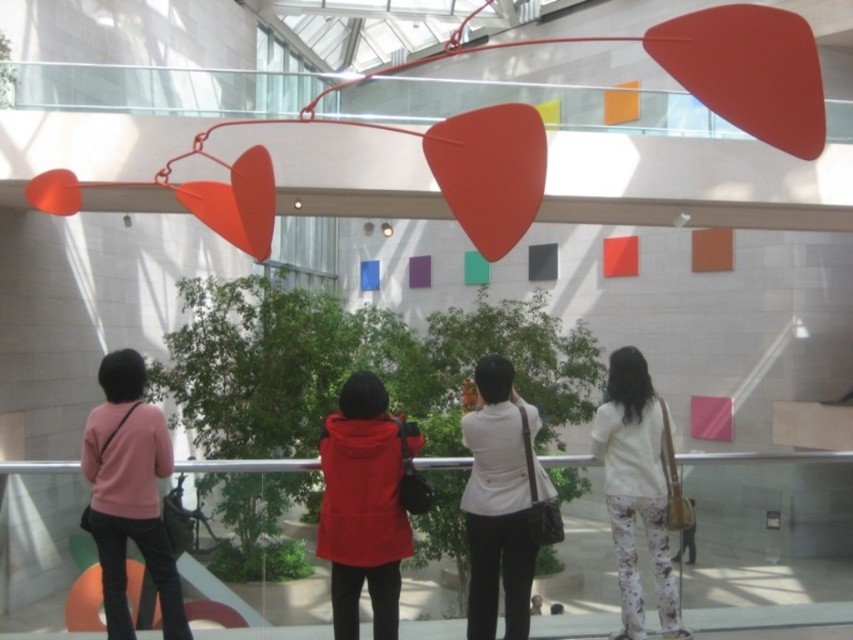
You are a photographer trying to capture a group photo of the matte red jacket at center and the pink matte sweater at lower left. Since you want to ensure both subjects are clearly visible, which person should you position closer to the camera to avoid being cut off?

The matte red jacket at center is narrower than the pink matte sweater at lower left, so positioning the matte red jacket at center closer to the camera would ensure it remains visible without being cut off.